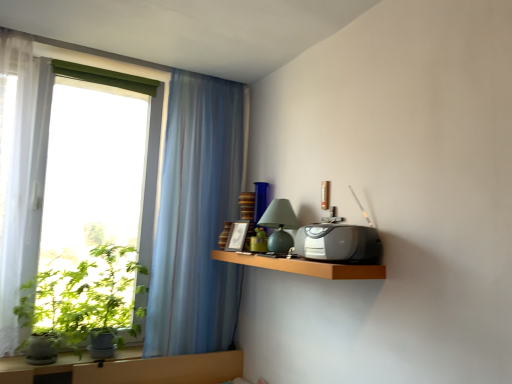
Question: Can you confirm if matte green glass table lamp at center is bigger than wooden shelf at upper right?

Choices:
 (A) yes
 (B) no

Answer: (B)

Question: Can you see matte green glass table lamp at center touching wooden shelf at upper right?

Choices:
 (A) no
 (B) yes

Answer: (A)

Question: Is matte green glass table lamp at center at the left side of wooden shelf at upper right?

Choices:
 (A) no
 (B) yes

Answer: (B)

Question: Is matte green glass table lamp at center to the right of wooden shelf at upper right from the viewer's perspective?

Choices:
 (A) yes
 (B) no

Answer: (B)

Question: Would you consider matte green glass table lamp at center to be distant from wooden shelf at upper right?

Choices:
 (A) yes
 (B) no

Answer: (B)

Question: From the image's perspective, is matte green glass table lamp at center located above or below wooden shelf at upper right?

Choices:
 (A) above
 (B) below

Answer: (A)

Question: Is matte green glass table lamp at center situated inside wooden shelf at upper right or outside?

Choices:
 (A) inside
 (B) outside

Answer: (B)

Question: Based on their positions, is matte green glass table lamp at center located to the left or right of wooden shelf at upper right?

Choices:
 (A) right
 (B) left

Answer: (B)

Question: From a real-world perspective, is matte green glass table lamp at center physically located above or below wooden shelf at upper right?

Choices:
 (A) below
 (B) above

Answer: (B)

Question: In terms of width, does transparent glass window at left look wider or thinner when compared to wooden shelf at upper right?

Choices:
 (A) wide
 (B) thin

Answer: (B)

Question: In terms of height, does transparent glass window at left look taller or shorter compared to wooden shelf at upper right?

Choices:
 (A) short
 (B) tall

Answer: (B)

Question: From a real-world perspective, is transparent glass window at left physically located above or below wooden shelf at upper right?

Choices:
 (A) below
 (B) above

Answer: (B)

Question: Based on their positions, is transparent glass window at left located to the left or right of wooden shelf at upper right?

Choices:
 (A) left
 (B) right

Answer: (A)

Question: Choose the correct answer: Is wooden shelf at upper right inside satin black radio at upper right or outside it?

Choices:
 (A) inside
 (B) outside

Answer: (B)

Question: Is wooden shelf at upper right wider or thinner than satin black radio at upper right?

Choices:
 (A) wide
 (B) thin

Answer: (A)